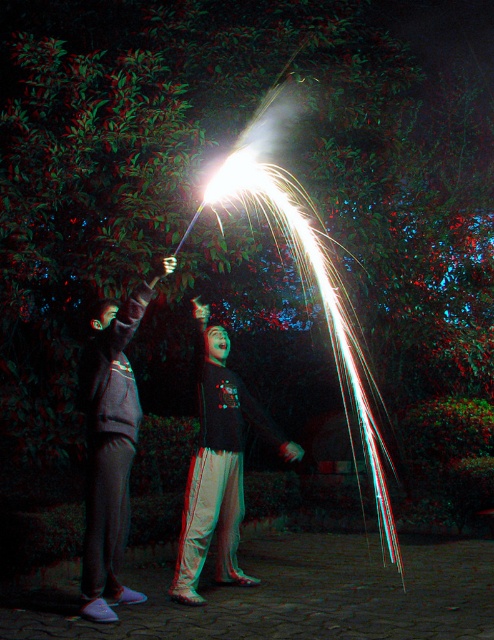
You are standing at the origin point of the coordinate system in the image. The gray sweatpants at left are located at point (x=111, y=445). If you want to walk directly to the gray sweatpants at left, which direction should you move in terms of x and y coordinates?

To reach the gray sweatpants at left located at point (x=111, y=445), you should move in the positive x and positive y direction since the coordinates are both greater than zero.

In the scene shown: You are standing at the center of the paved area and want to hand a sparkler to the person wearing the gray sweatpants at left. In which direction should you move to reach them?

You should move to the left to reach the gray sweatpants at left, as they are positioned at point (111, 445), which is to the left side of the paved area.

You are a photographer trying to capture a photo of both the gray sweatpants at left and the black matte shirt at center in the same frame. Which object should you focus on first to ensure both are in focus?

You should focus on the black matte shirt at center first because it is wider than the gray sweatpants at left, ensuring that the wider object is within the depth of field.